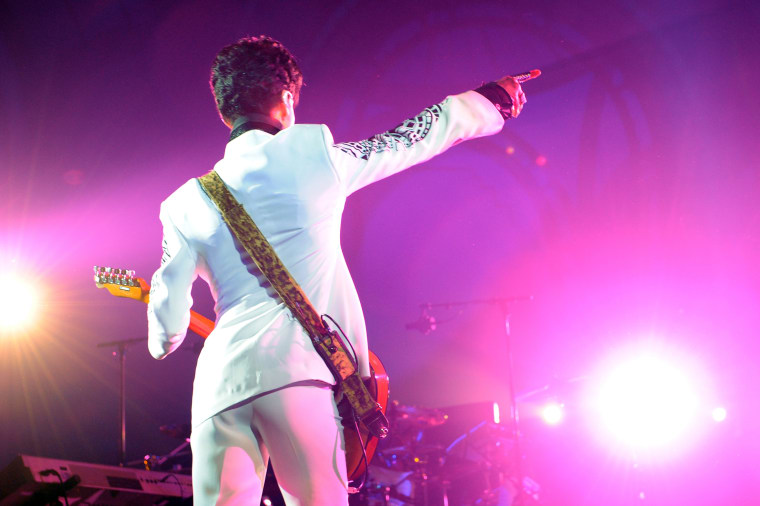
Locate an element on the screen. The image size is (760, 506). lights is located at coordinates pos(21,313), pos(648,410), pos(716,414), pos(556,412).